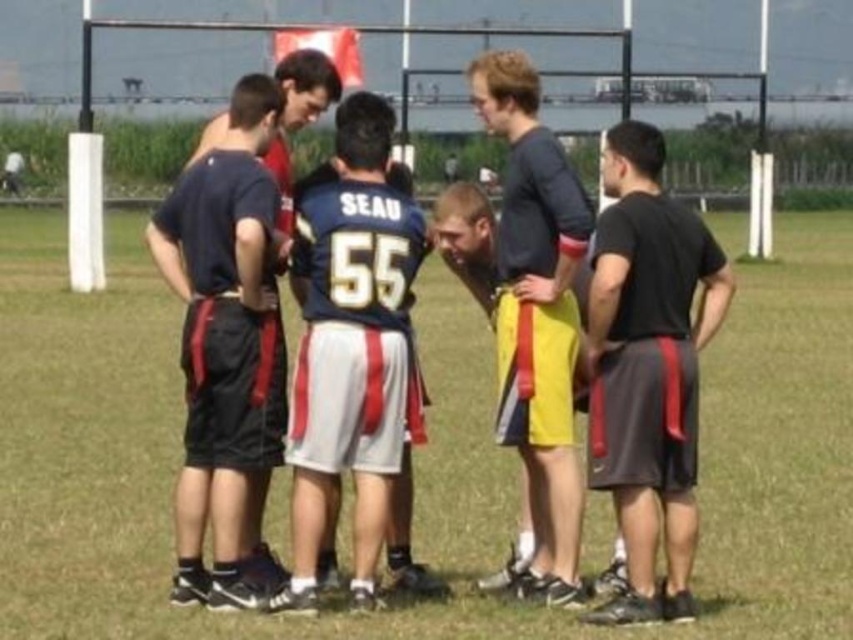
You are a photographer positioned at the center of the field. You want to take a photo of the matte black shorts at left. Where should you aim your camera relative to the center of the field?

The matte black shorts at left are located at point 0.497 on the x axis and 0.266 on the y axis, so you should aim your camera slightly to the right and slightly upwards from the center of the field to capture them.